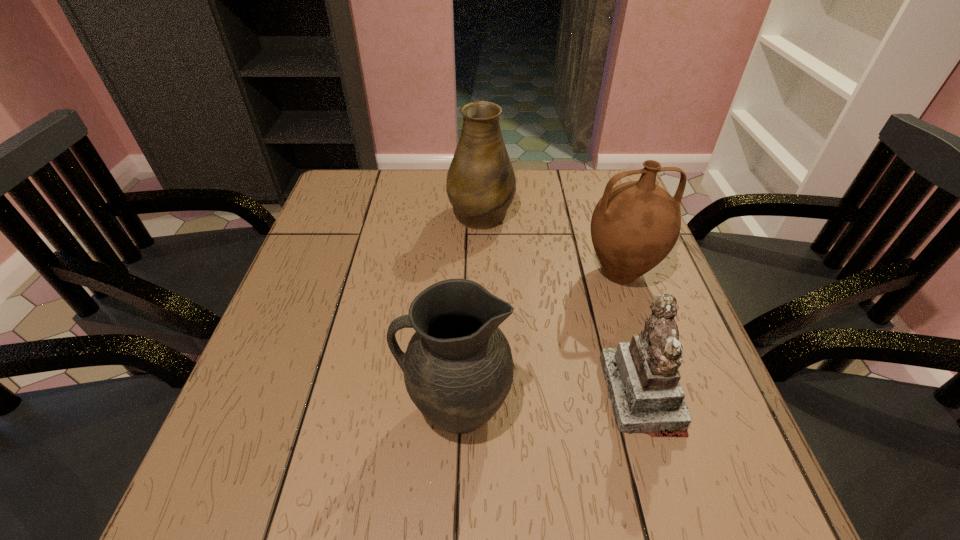
Identify the location of blank area located 0.230m on the side of the nearest pitcher with the handle. The height and width of the screenshot is (540, 960). (277, 409).

I want to click on free spot located on the side of the nearest pitcher with the handle, so click(354, 409).

What are the coordinates of `vacant space situated on the front-facing side of the shortest object` in the screenshot? It's located at (464, 394).

Locate an element on the screen. Image resolution: width=960 pixels, height=540 pixels. vacant space located 0.270m on the front-facing side of the shortest object is located at coordinates (464, 394).

This screenshot has height=540, width=960. Find the location of `blank area located on the front-facing side of the shortest object`. blank area located on the front-facing side of the shortest object is located at coordinates (527, 394).

Where is `object located at the far edge`? This screenshot has width=960, height=540. object located at the far edge is located at coordinates (481, 185).

This screenshot has height=540, width=960. What are the coordinates of `pitcher located in the right edge section of the desktop` in the screenshot? It's located at (635, 225).

Find the location of a particular element. Image resolution: width=960 pixels, height=540 pixels. figurine that is at the right edge is located at coordinates (642, 377).

Locate an element on the screen. The height and width of the screenshot is (540, 960). vacant space at the near edge is located at coordinates (565, 491).

This screenshot has width=960, height=540. What are the coordinates of `vacant space at the left edge` in the screenshot? It's located at (345, 251).